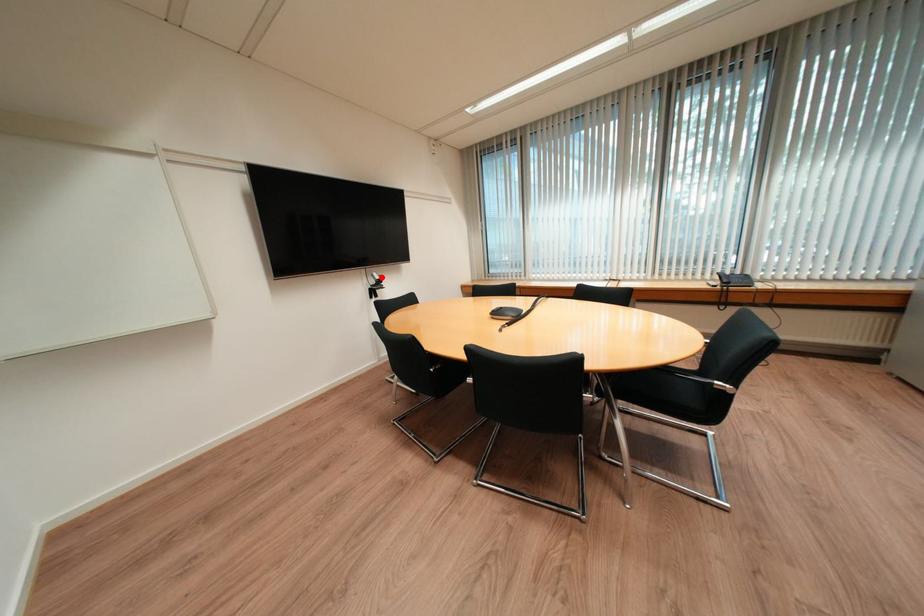
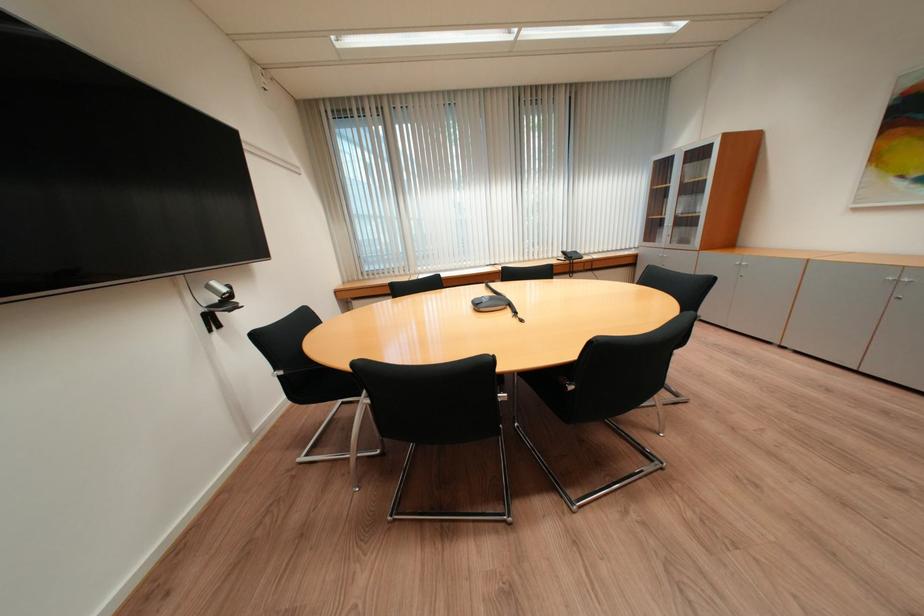
Question: A red point is marked in image1. In image2, is the corresponding 3D point closer to the camera or farther? Reply with the corresponding letter.

Choices:
 (A) The corresponding 3D point is closer.
 (B) The corresponding 3D point is farther.

Answer: (B)